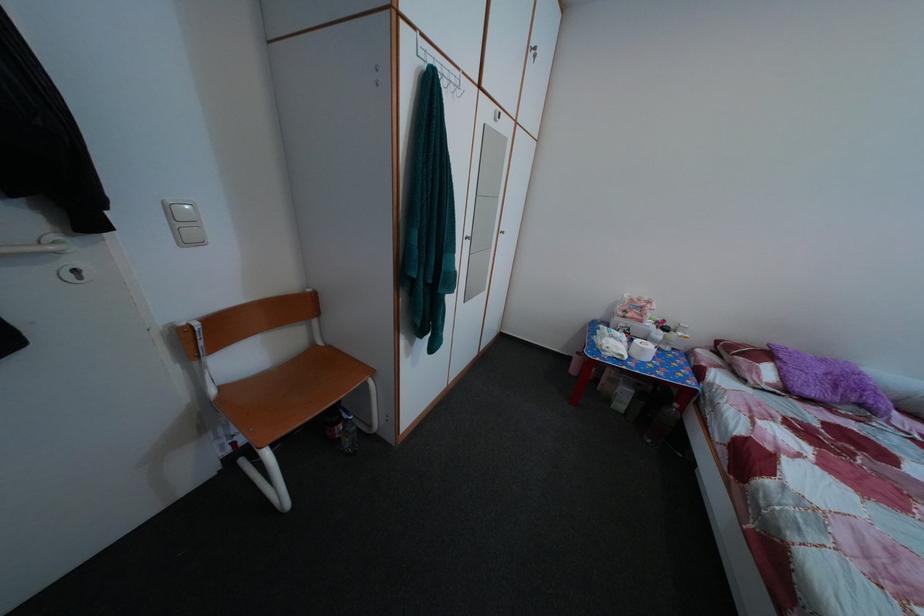
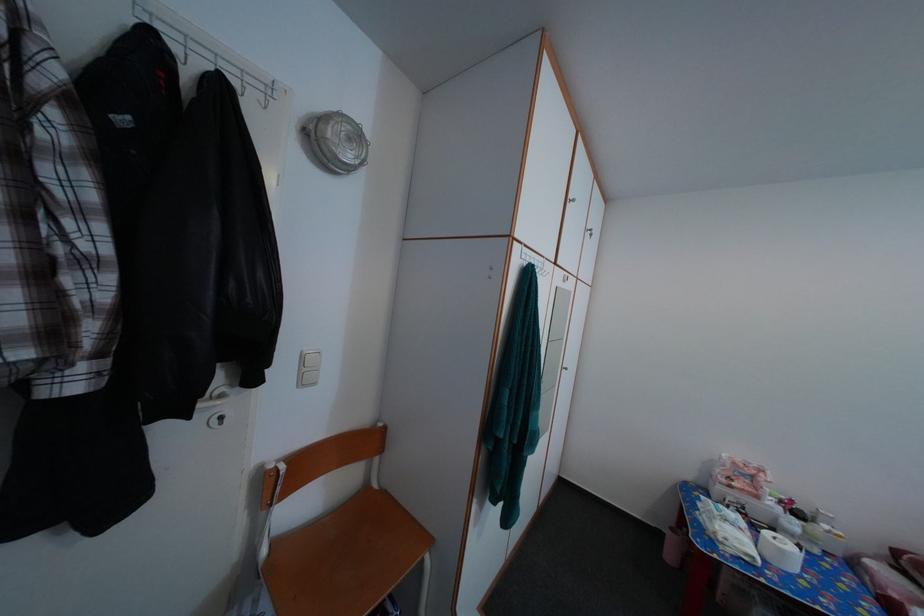
Where in the second image is the point corresponding to point 188,233 from the first image?

(313, 378)